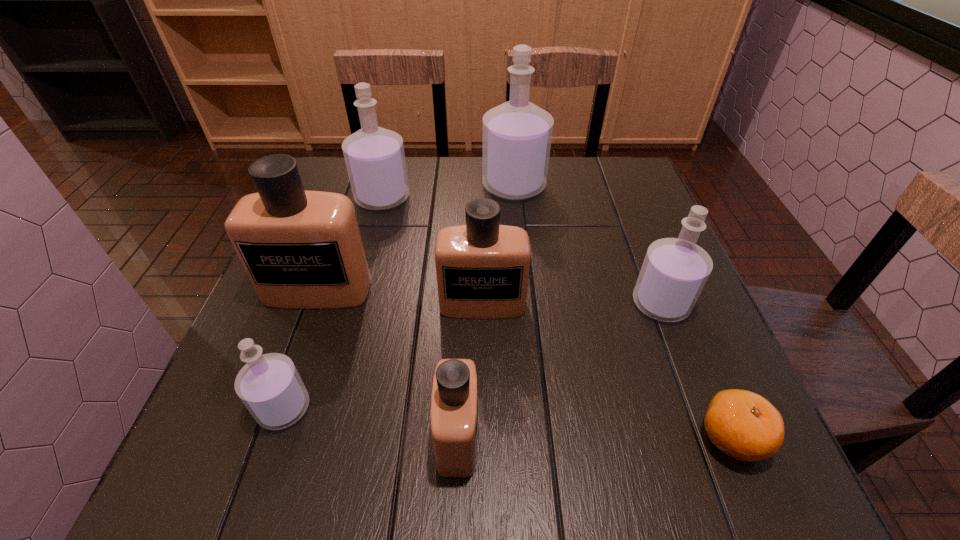
The image size is (960, 540). Find the location of `the tallest perfume`. the tallest perfume is located at coordinates (517, 135).

Locate an element on the screen. This screenshot has height=540, width=960. the biggest purple perfume is located at coordinates (517, 135).

Locate an element on the screen. the second biggest purple perfume is located at coordinates pos(374,156).

Where is `the biggest beige perfume`? This screenshot has width=960, height=540. the biggest beige perfume is located at coordinates 301,249.

Where is `the rightmost purple perfume`? Image resolution: width=960 pixels, height=540 pixels. the rightmost purple perfume is located at coordinates (675, 270).

Image resolution: width=960 pixels, height=540 pixels. What are the coordinates of `the second nearest purple perfume` in the screenshot? It's located at (675, 270).

Image resolution: width=960 pixels, height=540 pixels. What are the coordinates of `the second smallest beige perfume` in the screenshot? It's located at (482, 268).

At what (x,y) coordinates should I click in order to perform the action: click on the nearest purple perfume. Please return your answer as a coordinate pair (x, y). This screenshot has width=960, height=540. Looking at the image, I should click on (269, 385).

The width and height of the screenshot is (960, 540). I want to click on the smallest beige perfume, so click(454, 401).

What are the coordinates of `clementine` in the screenshot? It's located at (744, 425).